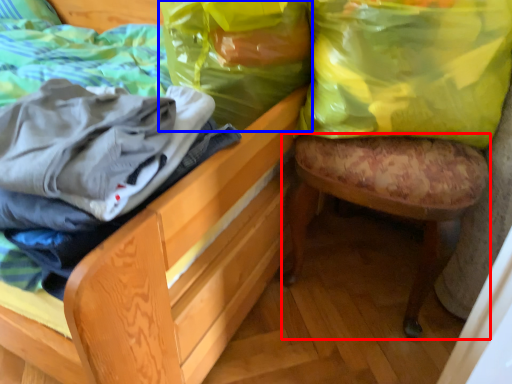
Question: Among these objects, which one is farthest to the camera, stool (highlighted by a red box) or shopping bag (highlighted by a blue box)?

Choices:
 (A) stool
 (B) shopping bag

Answer: (B)